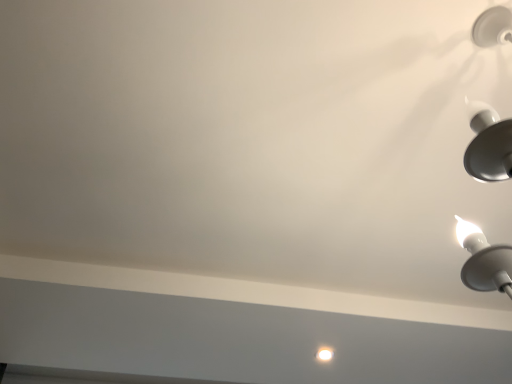
Where is `white glossy droplight at lower center`? The image size is (512, 384). white glossy droplight at lower center is located at coordinates (325, 354).

Image resolution: width=512 pixels, height=384 pixels. What do you see at coordinates (325, 354) in the screenshot?
I see `white glossy droplight at lower center` at bounding box center [325, 354].

Measure the distance between point (317, 359) and camera.

Point (317, 359) is 1.82 meters from camera.

You are a GUI agent. You are given a task and a screenshot of the screen. Output one action in this format:
    pyautogui.click(x=<x>, y=<y>)
    Task: Click on the white glossy droplight at lower center
    
    Given the screenshot: What is the action you would take?
    pyautogui.click(x=325, y=354)